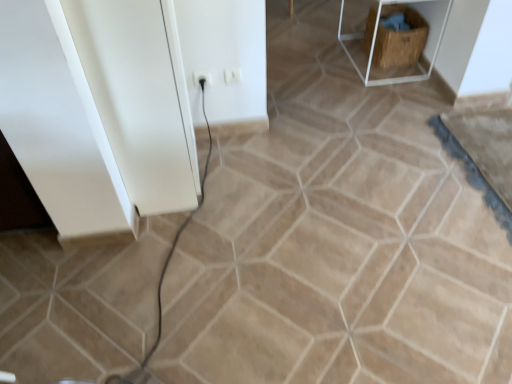
I want to click on white plastic electric outlet at center, which is the second electric outlet in left-to-right order, so click(x=232, y=76).

This screenshot has height=384, width=512. What do you see at coordinates (202, 78) in the screenshot?
I see `white plastic electric outlet at center, the 2th electric outlet positioned from the right` at bounding box center [202, 78].

Measure the distance between point (378, 8) and camera.

2.69 meters.

Identify the location of brown woven crate at upper right. The image size is (512, 384). (400, 38).

Can you confirm if wooden crate at upper right is bigger than white glossy cabinet at left?

Yes, wooden crate at upper right is bigger than white glossy cabinet at left.

Does wooden crate at upper right touch white glossy cabinet at left?

No, wooden crate at upper right is not with white glossy cabinet at left.

Is wooden crate at upper right in front of or behind white glossy cabinet at left in the image?

wooden crate at upper right is behind white glossy cabinet at left.

Between wooden crate at upper right and white plastic electric outlet at center, marked as the 1th electric outlet in a right-to-left arrangement, which one has less height?

white plastic electric outlet at center, marked as the 1th electric outlet in a right-to-left arrangement, is shorter.

Does wooden crate at upper right touch white plastic electric outlet at center, which is the second electric outlet in left-to-right order?

No, wooden crate at upper right is not beside white plastic electric outlet at center, which is the second electric outlet in left-to-right order.

Is wooden crate at upper right to the right of white plastic electric outlet at center, which is the second electric outlet in left-to-right order, from the viewer's perspective?

Yes, wooden crate at upper right is to the right of white plastic electric outlet at center, which is the second electric outlet in left-to-right order.

Between wooden crate at upper right and white plastic electric outlet at center, which is the second electric outlet in left-to-right order, which one has larger size?

With larger size is wooden crate at upper right.

Does white plastic electric outlet at center, marked as the 1th electric outlet in a right-to-left arrangement, come in front of brown woven crate at upper right?

Yes, it is.

Is white plastic electric outlet at center, which is the second electric outlet in left-to-right order, at the right side of brown woven crate at upper right?

In fact, white plastic electric outlet at center, which is the second electric outlet in left-to-right order, is to the left of brown woven crate at upper right.

Considering the relative sizes of white plastic electric outlet at center, marked as the 1th electric outlet in a right-to-left arrangement, and brown woven crate at upper right in the image provided, is white plastic electric outlet at center, marked as the 1th electric outlet in a right-to-left arrangement, smaller than brown woven crate at upper right?

Indeed, white plastic electric outlet at center, marked as the 1th electric outlet in a right-to-left arrangement, has a smaller size compared to brown woven crate at upper right.

I want to click on crate that is on the right side of white plastic electric outlet at center, marked as the 1th electric outlet in a right-to-left arrangement, so click(400, 38).

Between white glossy cabinet at left and white plastic electric outlet at center, the first electric outlet in the left-to-right sequence, which one has more height?

white glossy cabinet at left.

Is white glossy cabinet at left positioned beyond the bounds of white plastic electric outlet at center, the first electric outlet in the left-to-right sequence?

Yes, white glossy cabinet at left is outside of white plastic electric outlet at center, the first electric outlet in the left-to-right sequence.

How distant is white glossy cabinet at left from white plastic electric outlet at center, the 2th electric outlet positioned from the right?

white glossy cabinet at left is 28.80 inches away from white plastic electric outlet at center, the 2th electric outlet positioned from the right.

Could you tell me if white glossy cabinet at left is facing white plastic electric outlet at center, the first electric outlet in the left-to-right sequence?

No, white glossy cabinet at left is not facing towards white plastic electric outlet at center, the first electric outlet in the left-to-right sequence.

Based on the photo, considering the relative positions of brown woven crate at upper right and wooden crate at upper right in the image provided, is brown woven crate at upper right to the right of wooden crate at upper right from the viewer's perspective?

Yes, brown woven crate at upper right is to the right of wooden crate at upper right.

Which is behind, point (367, 26) or point (376, 18)?

The point (367, 26) is farther.

Considering the sizes of brown woven crate at upper right and wooden crate at upper right in the image, is brown woven crate at upper right taller or shorter than wooden crate at upper right?

In the image, brown woven crate at upper right appears to be shorter than wooden crate at upper right.

The height and width of the screenshot is (384, 512). I want to click on furniture that is above the brown woven crate at upper right (from a real-world perspective), so click(x=374, y=47).

Can you confirm if wooden crate at upper right is smaller than brown woven crate at upper right?

Actually, wooden crate at upper right might be larger than brown woven crate at upper right.

Is wooden crate at upper right thinner than brown woven crate at upper right?

No, wooden crate at upper right is not thinner than brown woven crate at upper right.

At what (x,y) coordinates should I click in order to perform the action: click on furniture above the brown woven crate at upper right (from a real-world perspective). Please return your answer as a coordinate pair (x, y). Looking at the image, I should click on (374, 47).

Between wooden crate at upper right and brown woven crate at upper right, which one has less height?

brown woven crate at upper right is shorter.

Considering the relative positions of brown woven crate at upper right and white plastic electric outlet at center, the 2th electric outlet positioned from the right, in the image provided, is brown woven crate at upper right in front of white plastic electric outlet at center, the 2th electric outlet positioned from the right,?

No, it is behind white plastic electric outlet at center, the 2th electric outlet positioned from the right.

Is brown woven crate at upper right positioned far away from white plastic electric outlet at center, the 2th electric outlet positioned from the right?

That's right, there is a large distance between brown woven crate at upper right and white plastic electric outlet at center, the 2th electric outlet positioned from the right.

Who is bigger, brown woven crate at upper right or white plastic electric outlet at center, the 2th electric outlet positioned from the right?

brown woven crate at upper right.

Find the location of a particular element. cabinetry lying on the left of wooden crate at upper right is located at coordinates (97, 112).

You are a GUI agent. You are given a task and a screenshot of the screen. Output one action in this format:
    pyautogui.click(x=<x>, y=<y>)
    Task: Click on the furniture behind the white plastic electric outlet at center, which is the second electric outlet in left-to-right order
    This screenshot has width=512, height=384.
    Given the screenshot: What is the action you would take?
    pyautogui.click(x=374, y=47)

Looking at the image, which one is located closer to wooden crate at upper right, brown woven crate at upper right or white plastic electric outlet at center, marked as the 1th electric outlet in a right-to-left arrangement?

brown woven crate at upper right is closer to wooden crate at upper right.

Considering their positions, is wooden crate at upper right positioned further to white plastic electric outlet at center, the first electric outlet in the left-to-right sequence, than white glossy cabinet at left?

wooden crate at upper right.

Based on their spatial positions, is brown woven crate at upper right or white plastic electric outlet at center, the 2th electric outlet positioned from the right, further from wooden crate at upper right?

Based on the image, white plastic electric outlet at center, the 2th electric outlet positioned from the right, appears to be further to wooden crate at upper right.

When comparing their distances from white glossy cabinet at left, does wooden crate at upper right or brown woven crate at upper right seem further?

Among the two, brown woven crate at upper right is located further to white glossy cabinet at left.

Based on their spatial positions, is wooden crate at upper right or brown woven crate at upper right closer to white plastic electric outlet at center, marked as the 1th electric outlet in a right-to-left arrangement?

Among the two, wooden crate at upper right is located nearer to white plastic electric outlet at center, marked as the 1th electric outlet in a right-to-left arrangement.

Estimate the real-world distances between objects in this image. Which object is closer to wooden crate at upper right, white glossy cabinet at left or brown woven crate at upper right?

brown woven crate at upper right is positioned closer to the anchor wooden crate at upper right.

From the image, which object appears to be farther from white glossy cabinet at left, wooden crate at upper right or white plastic electric outlet at center, which is the second electric outlet in left-to-right order?

Based on the image, wooden crate at upper right appears to be further to white glossy cabinet at left.

When comparing their distances from white plastic electric outlet at center, which is the second electric outlet in left-to-right order, does white glossy cabinet at left or white plastic electric outlet at center, the 2th electric outlet positioned from the right, seem closer?

Based on the image, white plastic electric outlet at center, the 2th electric outlet positioned from the right, appears to be nearer to white plastic electric outlet at center, which is the second electric outlet in left-to-right order.

Locate an element on the screen. Image resolution: width=512 pixels, height=384 pixels. furniture situated between white plastic electric outlet at center, the first electric outlet in the left-to-right sequence, and brown woven crate at upper right from left to right is located at coordinates (374, 47).

Image resolution: width=512 pixels, height=384 pixels. In order to click on electric outlet between white plastic electric outlet at center, the first electric outlet in the left-to-right sequence, and brown woven crate at upper right from left to right in this screenshot , I will do `click(232, 76)`.

Locate an element on the screen. furniture between white glossy cabinet at left and brown woven crate at upper right in the horizontal direction is located at coordinates (374, 47).

I want to click on electric outlet between white plastic electric outlet at center, the first electric outlet in the left-to-right sequence, and wooden crate at upper right, in the horizontal direction, so click(232, 76).